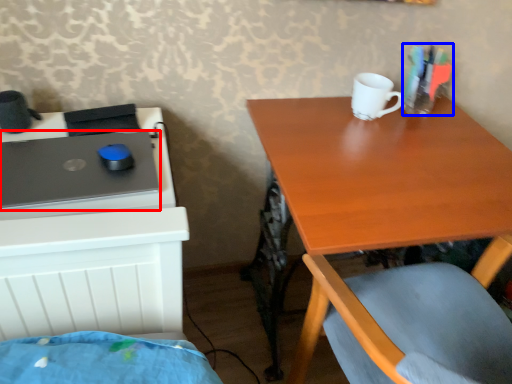
Question: Which object is closer to the camera taking this photo, laptop (highlighted by a red box) or stationery (highlighted by a blue box)?

Choices:
 (A) laptop
 (B) stationery

Answer: (A)